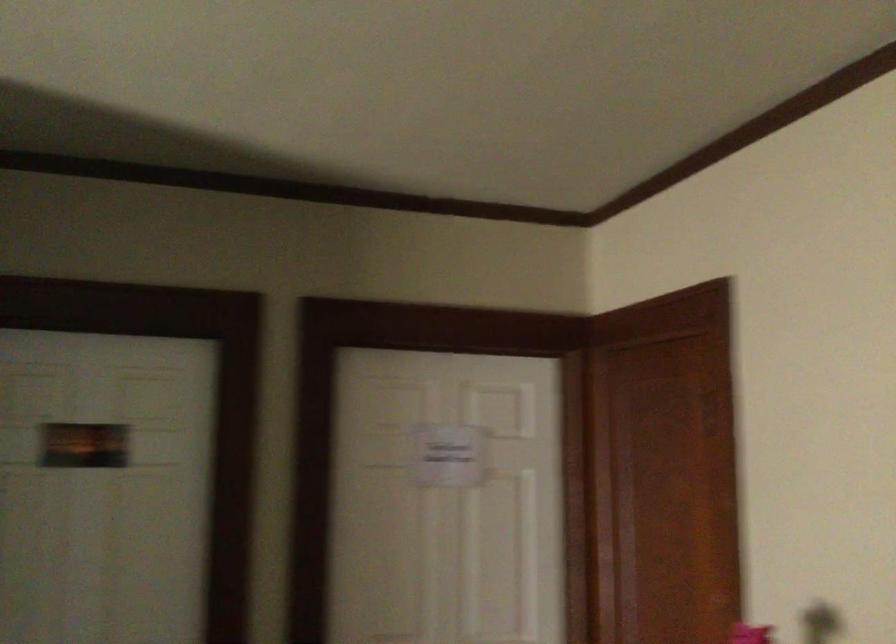
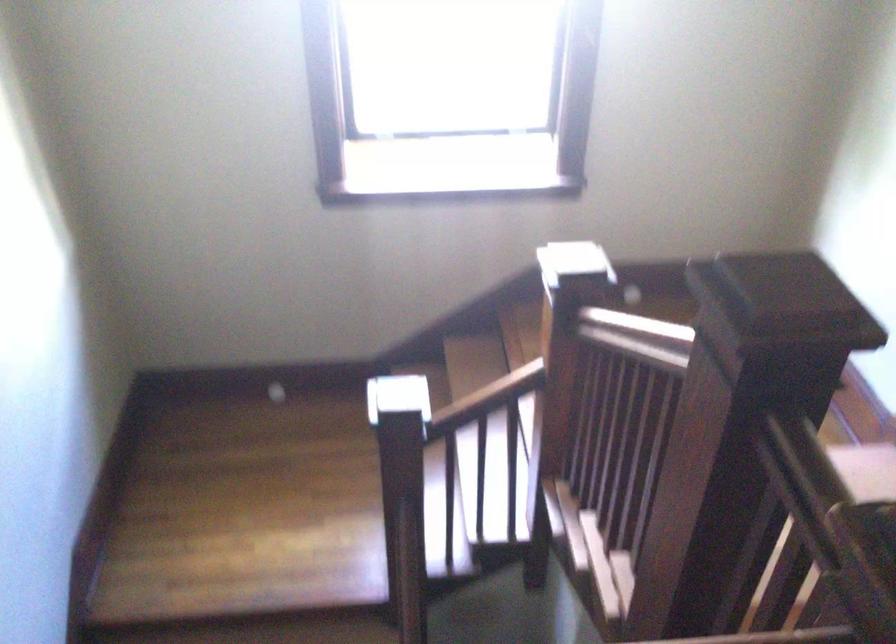
How did the camera likely rotate?

The camera rotated toward left-down.